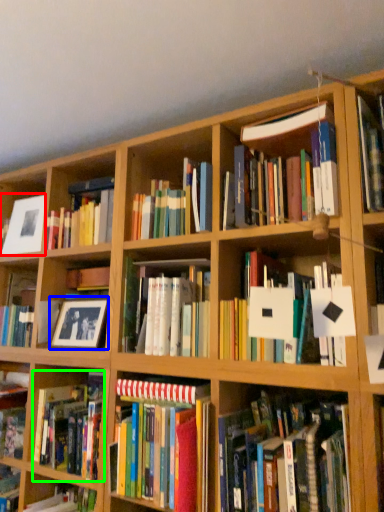
Question: Estimate the real-world distances between objects in this image. Which object is closer to picture frame (highlighted by a red box), picture frame (highlighted by a blue box) or book (highlighted by a green box)?

Choices:
 (A) picture frame
 (B) book

Answer: (A)